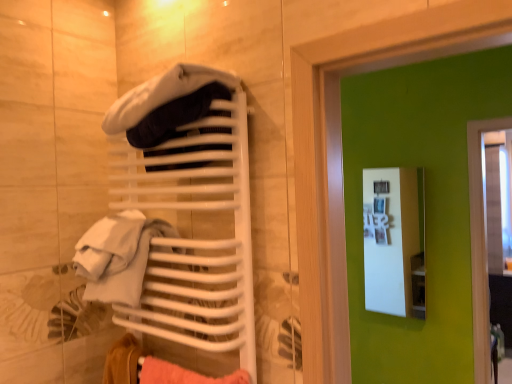
Question: Considering the positions of white matte towel rack at upper left and white glossy medicine cabinet at upper center in the image, is white matte towel rack at upper left bigger or smaller than white glossy medicine cabinet at upper center?

Choices:
 (A) small
 (B) big

Answer: (B)

Question: Would you say white matte towel rack at upper left is inside or outside white glossy medicine cabinet at upper center?

Choices:
 (A) inside
 (B) outside

Answer: (B)

Question: Estimate the real-world distances between objects in this image. Which object is closer to the velvety white hat at upper center?

Choices:
 (A) white glossy medicine cabinet at upper center
 (B) white matte towel rack at upper left

Answer: (B)

Question: Which is farther from the white glossy medicine cabinet at upper center?

Choices:
 (A) white matte towel rack at upper left
 (B) velvety white hat at upper center

Answer: (B)